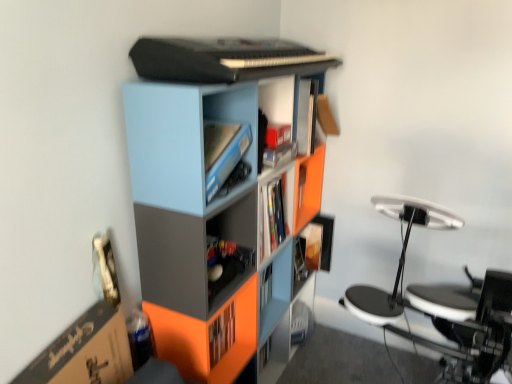
Question: Is matte plastic bookcase at center inside or outside of matte black shelf at center?

Choices:
 (A) inside
 (B) outside

Answer: (B)

Question: Based on their sizes in the image, would you say matte plastic bookcase at center is bigger or smaller than matte black shelf at center?

Choices:
 (A) big
 (B) small

Answer: (A)

Question: Estimate the real-world distances between objects in this image. Which object is closer to the matte plastic bookcase at center?

Choices:
 (A) light blue plastic cabinet at upper center
 (B) matte black shelf at center

Answer: (B)

Question: Which object is positioned closest to the matte plastic bookcase at center?

Choices:
 (A) light blue plastic cabinet at upper center
 (B) matte black shelf at center

Answer: (B)